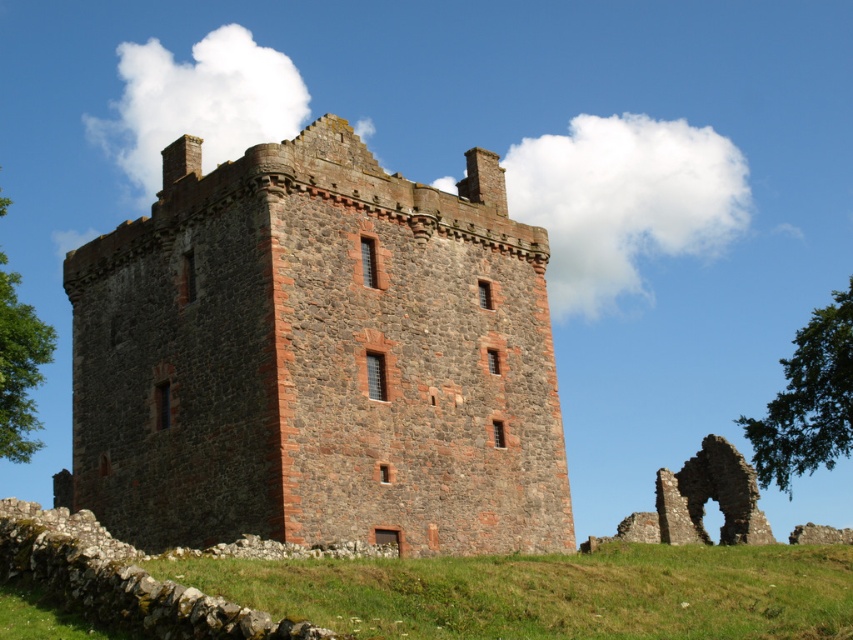
Question: Which point is closer to the camera?

Choices:
 (A) green leafy tree at left
 (B) green leafy tree at upper right

Answer: (A)

Question: Where is rustic stone tower at center located in relation to green leafy tree at upper right in the image?

Choices:
 (A) above
 (B) below

Answer: (A)

Question: Is green grassy at lower center thinner than green leafy tree at left?

Choices:
 (A) no
 (B) yes

Answer: (B)

Question: Is rustic stone tower at center wider than green grassy at lower center?

Choices:
 (A) yes
 (B) no

Answer: (B)

Question: Which point appears farthest from the camera in this image?

Choices:
 (A) (805, 552)
 (B) (4, 289)
 (C) (799, 332)

Answer: (C)

Question: Among these objects, which one is farthest from the camera?

Choices:
 (A) green leafy tree at upper right
 (B) green grassy at lower center
 (C) green leafy tree at left
 (D) rustic stone tower at center

Answer: (A)